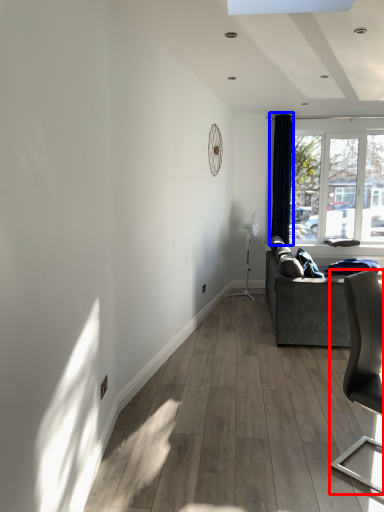
Question: Which object is closer to the camera taking this photo, chair (highlighted by a red box) or curtain (highlighted by a blue box)?

Choices:
 (A) chair
 (B) curtain

Answer: (A)